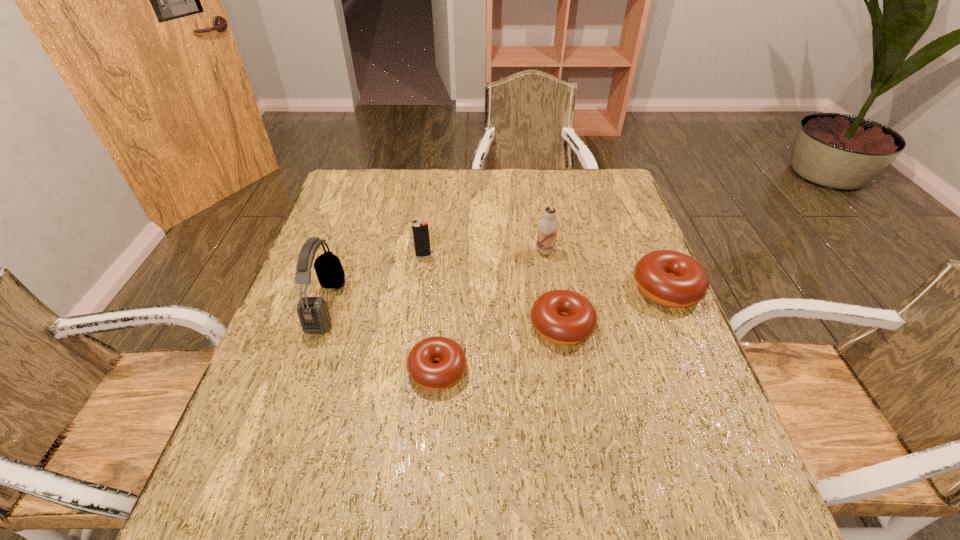
Find the location of `free spot located 0.060m on the right of the second tallest doughnut`. free spot located 0.060m on the right of the second tallest doughnut is located at coordinates (620, 326).

What are the coordinates of `free space located 0.110m on the front of the rightmost object` in the screenshot? It's located at (694, 352).

What are the coordinates of `free region located 0.080m on the right of the second tallest object` in the screenshot? It's located at (584, 251).

I want to click on vacant point located 0.360m on the front of the third tallest object, so click(x=407, y=370).

This screenshot has width=960, height=540. Find the location of `vacant area situated on the headband of the leftmost object`. vacant area situated on the headband of the leftmost object is located at coordinates (454, 305).

You are a GUI agent. You are given a task and a screenshot of the screen. Output one action in this format:
    pyautogui.click(x=<x>, y=<y>)
    Task: Click on the object present at the left edge
    This screenshot has height=540, width=960.
    Given the screenshot: What is the action you would take?
    pyautogui.click(x=314, y=317)

Identify the location of object that is at the right edge. The width and height of the screenshot is (960, 540). (670, 278).

Where is `free space at the far edge`? This screenshot has width=960, height=540. free space at the far edge is located at coordinates (433, 172).

This screenshot has width=960, height=540. Find the location of `blank area at the near edge`. blank area at the near edge is located at coordinates (504, 421).

At what (x,y) coordinates should I click in order to perform the action: click on vacant area at the left edge. Please return your answer as a coordinate pair (x, y). The width and height of the screenshot is (960, 540). Looking at the image, I should click on (367, 241).